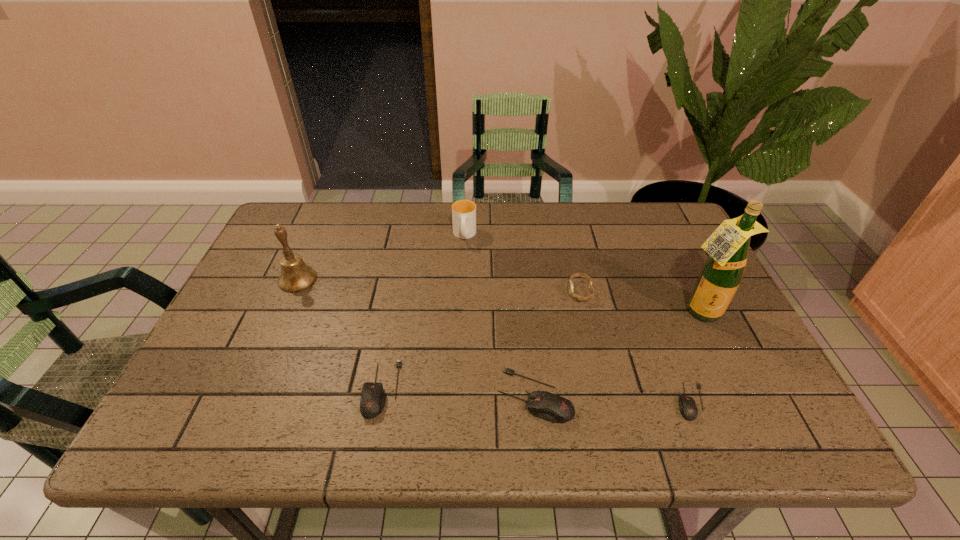
Select which object is the third closest to the second shortest object. Please provide its 2D coordinates. Your answer should be formatted as a tuple, i.e. [(x, y)], where the tuple contains the x and y coordinates of a point satisfying the conditions above.

[(463, 211)]

Locate which mouse is the second closest to the shortest object. Please provide its 2D coordinates. Your answer should be formatted as a tuple, i.e. [(x, y)], where the tuple contains the x and y coordinates of a point satisfying the conditions above.

[(373, 398)]

Identify which mouse is located as the second nearest to the second mouse from left to right. Please provide its 2D coordinates. Your answer should be formatted as a tuple, i.e. [(x, y)], where the tuple contains the x and y coordinates of a point satisfying the conditions above.

[(688, 409)]

This screenshot has height=540, width=960. In order to click on free space that satisfies the following two spatial constraints: 1. on the face of the watch; 2. on the front side of the leftmost mouse in this screenshot , I will do `click(603, 389)`.